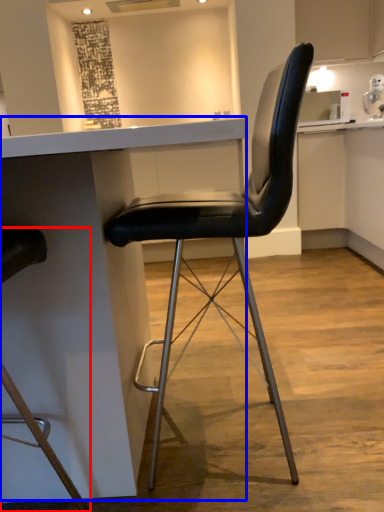
Question: Which of the following is the farthest to the observer, chair (highlighted by a red box) or table (highlighted by a blue box)?

Choices:
 (A) chair
 (B) table

Answer: (B)